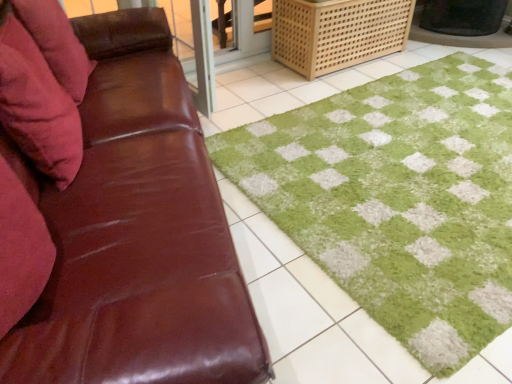
Identify the location of vacant area that is in front of light brown woven crate at upper right. (x=322, y=82).